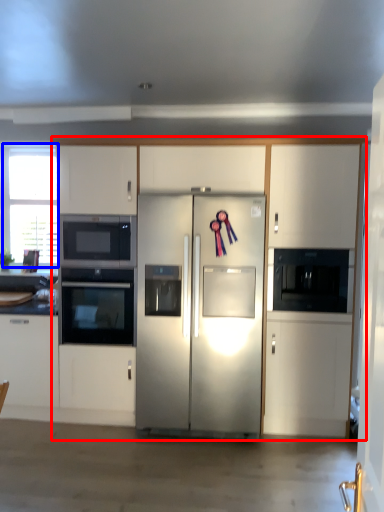
Question: Which object appears farthest to the camera in this image, cabinetry (highlighted by a red box) or window (highlighted by a blue box)?

Choices:
 (A) cabinetry
 (B) window

Answer: (B)